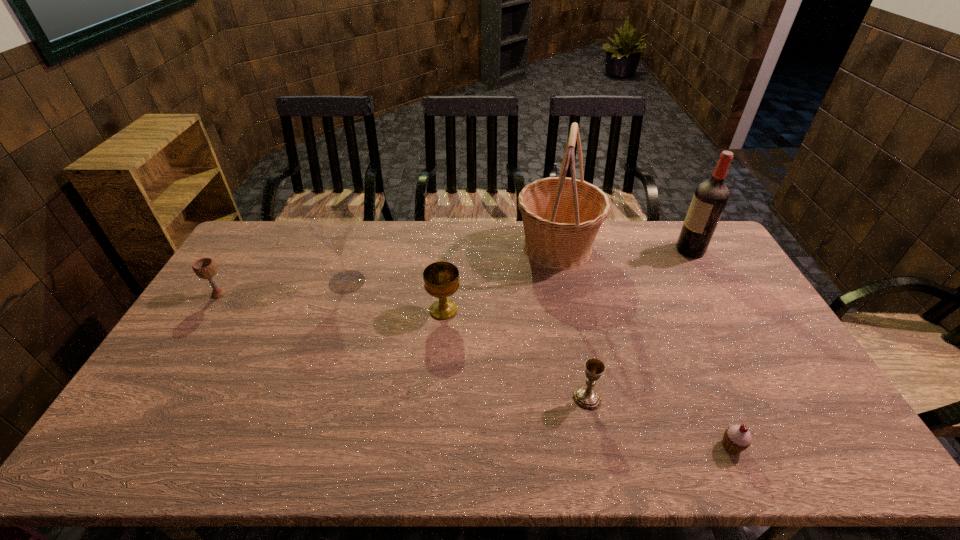
What are the coordinates of `cupcake` in the screenshot? It's located at (736, 439).

The image size is (960, 540). Identify the location of the shortest object. (736, 439).

This screenshot has height=540, width=960. Find the location of `vacant space located 0.090m on the right of the tallest object`. vacant space located 0.090m on the right of the tallest object is located at coordinates (624, 247).

Identify the location of vacant space situated on the front-facing side of the liquor. This screenshot has height=540, width=960. (586, 250).

Where is `free space located on the front-facing side of the liquor`? free space located on the front-facing side of the liquor is located at coordinates (572, 250).

Locate an element on the screen. This screenshot has width=960, height=540. free space located on the front-facing side of the liquor is located at coordinates (624, 250).

Find the location of a particular element. vacant area located on the left of the second object from left to right is located at coordinates (305, 282).

This screenshot has width=960, height=540. In order to click on free point located 0.340m on the front of the fourth shortest object in this screenshot , I will do `click(434, 424)`.

Locate an element on the screen. Image resolution: width=960 pixels, height=540 pixels. vacant space located 0.260m on the front of the leftmost chalice is located at coordinates (173, 367).

Identify the location of free space located on the back of the nearest chalice. The image size is (960, 540). (576, 345).